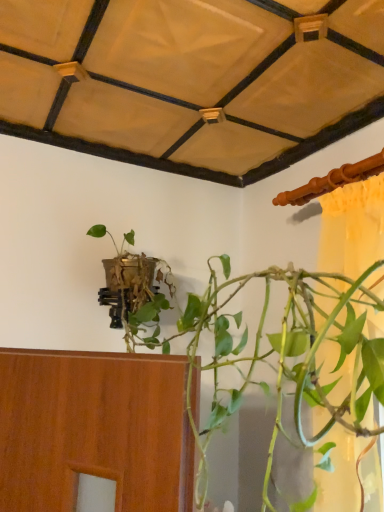
Describe the element at coordinates (125, 279) in the screenshot. The height and width of the screenshot is (512, 384). I see `green matte plant at center` at that location.

Find the location of a particular element. green matte plant at center is located at coordinates (125, 279).

Locate an element on the screen. green matte plant at center is located at coordinates (125, 279).